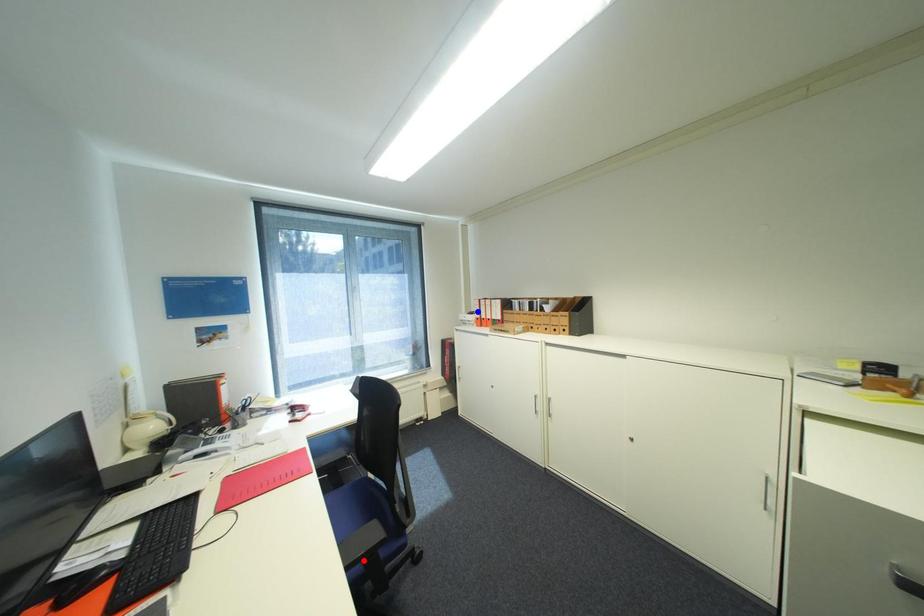
Question: In the image, two points are highlighted. Which point is nearer to the camera? Reply with the corresponding letter.

Choices:
 (A) blue point
 (B) red point

Answer: (B)